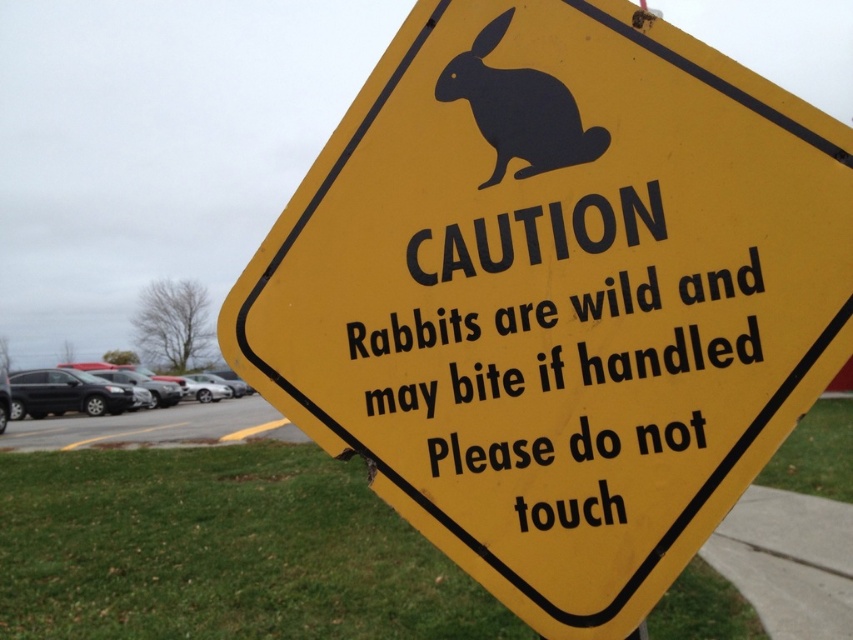
You are a delivery person who needs to place a new rectangular box on the yellow plastic sign at center without overlapping the black matte rabbit at upper center. Can you fit the box on the sign?

The yellow plastic sign at center might be wider than black matte rabbit at upper center, so it is possible that the box can be placed on the sign without overlapping the rabbit if the sign has enough space. However, the exact dimensions are uncertain.

You are a pedestrian walking on the sidewalk and see the yellow plastic sign at center and the black matte rabbit at upper center. Which object is located to the right of the other?

The black matte rabbit at upper center is located to the right of the yellow plastic sign at center.

You are a pedestrian approaching the yellow plastic sign at center and the black matte rabbit at upper center. Which object will appear larger to you as you walk towards them?

The yellow plastic sign at center will appear larger because it is closer to the viewer than the black matte rabbit at upper center.